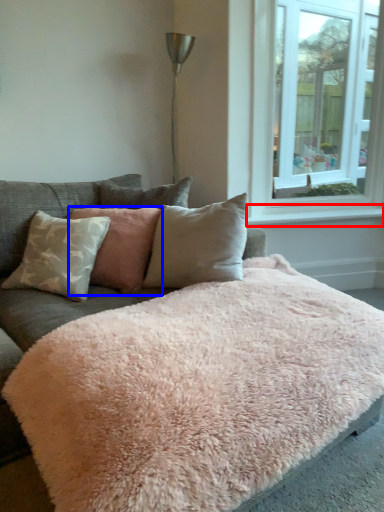
Question: Which of the following is the farthest to the observer, window sill (highlighted by a red box) or pillow (highlighted by a blue box)?

Choices:
 (A) window sill
 (B) pillow

Answer: (A)